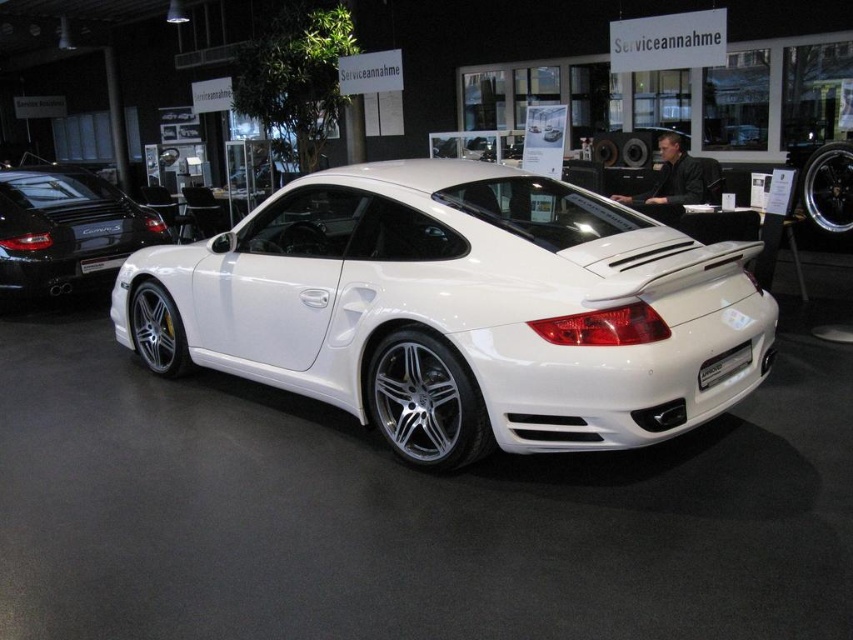
You are a photographer standing in front of the showroom floor. You need to capture a clear shot of the white glossy sports car at center and the white matte porsche at center. Which one will appear larger in your photo?

The white glossy sports car at center will appear larger in the photo because it is closer to the viewer than the white matte porsche at center.

You are a delivery person trying to park your van in the service center. The van requires a space that is at least 11 feet long. Based on the image, can you fit your van between the white matte porsche at center and the white metallic license plate at rear?

The white matte porsche at center is 10.99 feet from the white metallic license plate at rear, which means the distance is just under the required 11 feet. Therefore, the van may not fit comfortably in this space.

You are standing in the showroom and want to take a photo of the Porsche. You notice two points on the car, one at point coordinates point (622, 195) and another at point coordinates point (726, 369). Which point will appear closer to you in your photo?

Point (622, 195) is further to the camera than point (726, 369), so in the photo, point (622, 195) will appear closer to you.